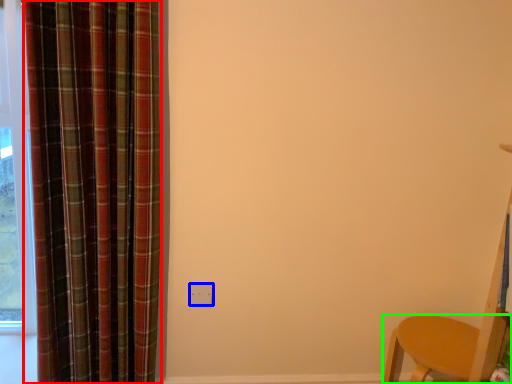
Question: Which is nearer to the curtain (highlighted by a red box)? electric outlet (highlighted by a blue box) or furniture (highlighted by a green box).

Choices:
 (A) electric outlet
 (B) furniture

Answer: (A)